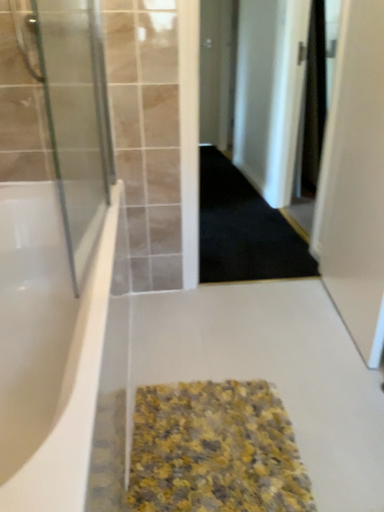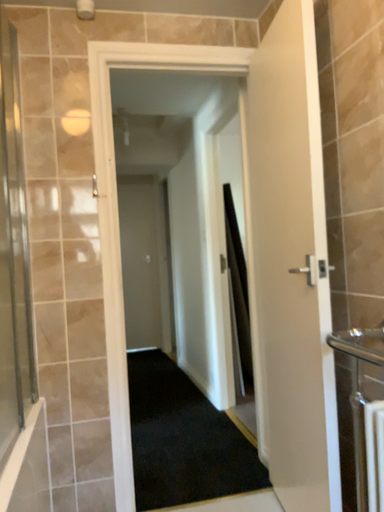
Question: How did the camera likely rotate when shooting the video?

Choices:
 (A) rotated downward
 (B) rotated upward

Answer: (B)